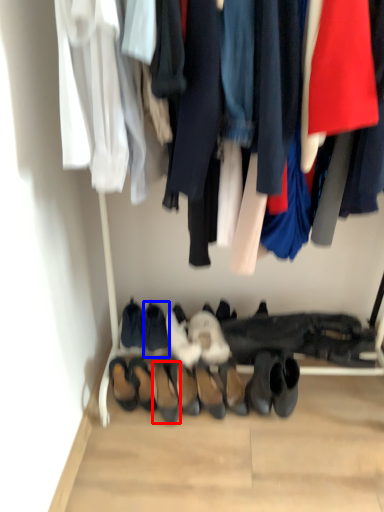
Question: Which of the following is the closest to the observer, footwear (highlighted by a red box) or footwear (highlighted by a blue box)?

Choices:
 (A) footwear
 (B) footwear

Answer: (A)